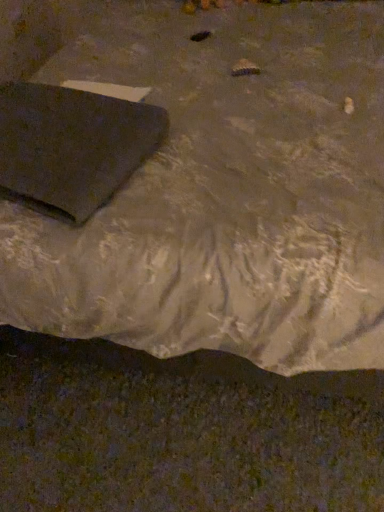
Question: Is point (107, 139) closer or farther from the camera than point (311, 206)?

Choices:
 (A) farther
 (B) closer

Answer: (A)

Question: Relative to matte black laptop at upper left, is matte black pad at lower left in front or behind?

Choices:
 (A) behind
 (B) front

Answer: (A)

Question: Is matte black pad at lower left taller or shorter than matte black laptop at upper left?

Choices:
 (A) tall
 (B) short

Answer: (B)

Question: Considering the positions of matte black laptop at upper left and matte black pad at lower left in the image, is matte black laptop at upper left taller or shorter than matte black pad at lower left?

Choices:
 (A) short
 (B) tall

Answer: (B)

Question: Is matte black laptop at upper left wider or thinner than matte black pad at lower left?

Choices:
 (A) thin
 (B) wide

Answer: (B)

Question: From a real-world perspective, relative to matte black pad at lower left, is matte black laptop at upper left vertically above or below?

Choices:
 (A) below
 (B) above

Answer: (A)

Question: Does point (294, 42) appear closer or farther from the camera than point (89, 93)?

Choices:
 (A) closer
 (B) farther

Answer: (B)